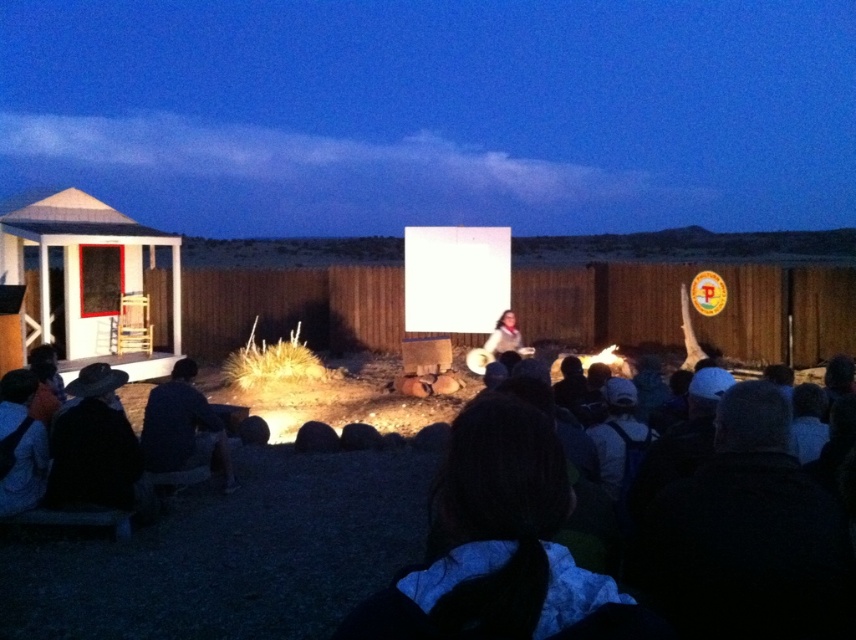
Question: Among these objects, which one is nearest to the camera?

Choices:
 (A) white wood hut at left
 (B) black felt hat at lower left
 (C) dark hair at lower center
 (D) dark blue fabric at lower left

Answer: (C)

Question: From the image, what is the correct spatial relationship of black felt hat at lower left in relation to matte black jacket at center?

Choices:
 (A) right
 (B) left

Answer: (B)

Question: Which point is closer to the camera?

Choices:
 (A) dark blue denim jeans at lower left
 (B) dark hair at lower center
 (C) black felt hat at lower left
 (D) dark blue fabric at lower left

Answer: (B)

Question: Does dark blue denim jeans at lower left appear on the left side of dark blue fabric at lower left?

Choices:
 (A) yes
 (B) no

Answer: (B)

Question: Is white wood hut at left to the left of black felt hat at lower left from the viewer's perspective?

Choices:
 (A) yes
 (B) no

Answer: (A)

Question: Which of the following is the closest to the observer?

Choices:
 (A) black felt hat at lower left
 (B) dark blue fabric at lower left
 (C) dark hair at lower center
 (D) white wood hut at left

Answer: (C)